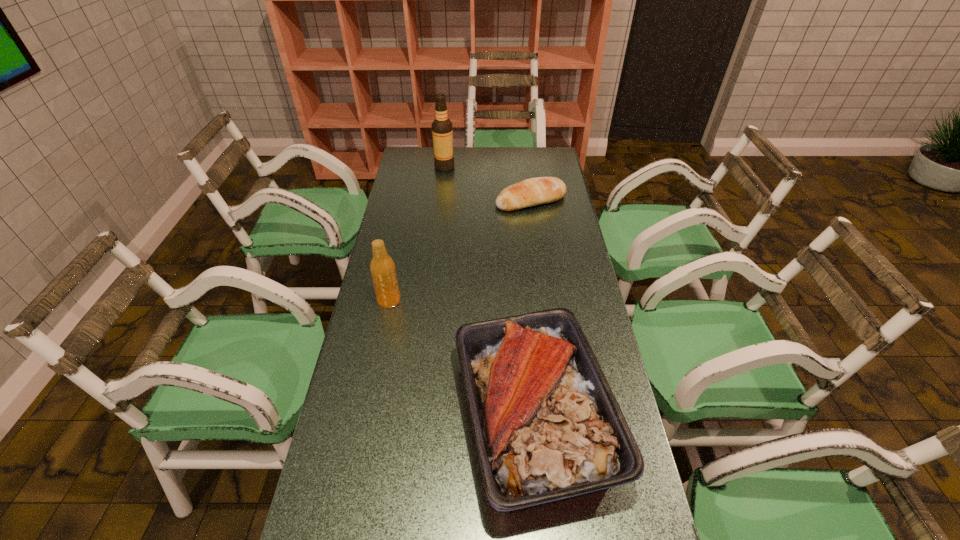
The image size is (960, 540). Find the location of `vacant position in the image that satisfies the following two spatial constraints: 1. on the label of the tallest object; 2. on the left side of the nearest object`. vacant position in the image that satisfies the following two spatial constraints: 1. on the label of the tallest object; 2. on the left side of the nearest object is located at coordinates (417, 415).